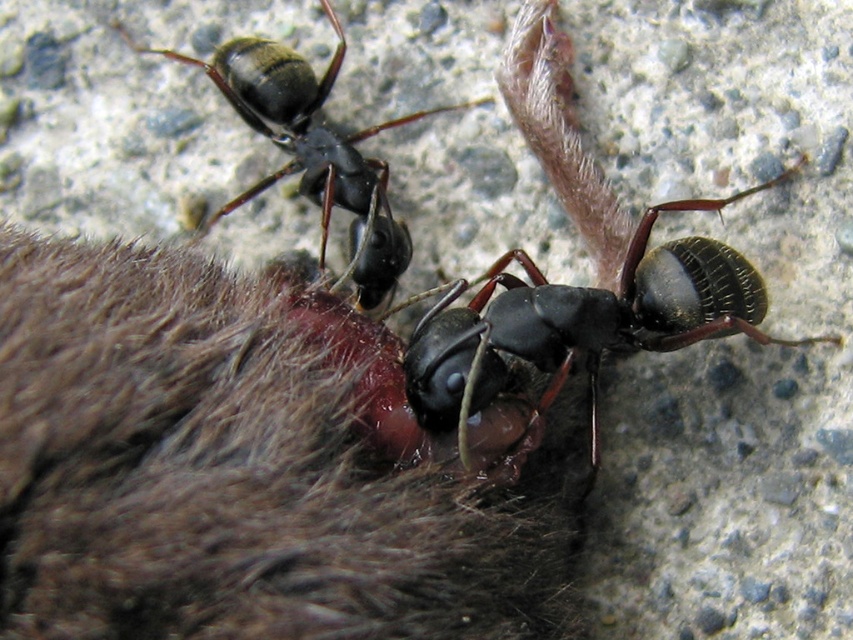
Consider the image. You are a tiny insect explorer. You see the brown fuzzy fur at center and the shiny black ant at upper left. Which object is closer to you from your current position?

The brown fuzzy fur at center is closer to you because it is in front of the shiny black ant at upper left.

You are an ant explorer in this scene. You need to move from point A to point B. Point A is at coordinate point[751,284] and point B is at coordinate point[357,257]. Which direction should you move to get from point A to point B?

To move from point A at coordinate point[751,284] to point B at coordinate point[357,257], you should move towards the lower left direction since point B is located below and to the left of point A.